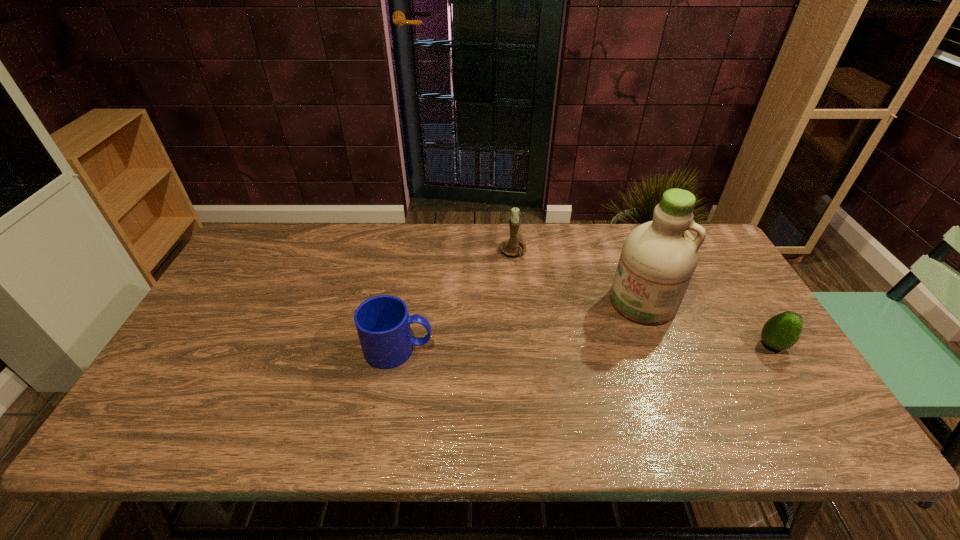
In order to click on vacant spot on the desktop that is between the leftmost object and the rightmost object and is positioned on the side of the second object from left to right with the handle in this screenshot , I will do `click(554, 348)`.

This screenshot has width=960, height=540. What are the coordinates of `vacant space on the desktop that is between the mug and the rightmost object and is positioned on the front label of the cleansing agent` in the screenshot? It's located at (607, 347).